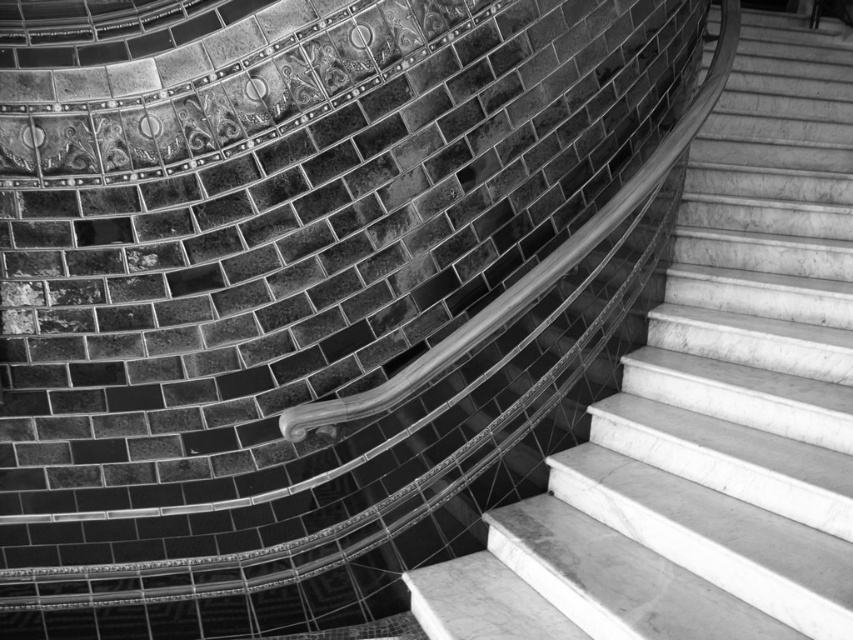
Is white marble stairs at center behind metallic polished handrail at center?

No, it is in front of metallic polished handrail at center.

Locate an element on the screen. The width and height of the screenshot is (853, 640). white marble stairs at center is located at coordinates (708, 403).